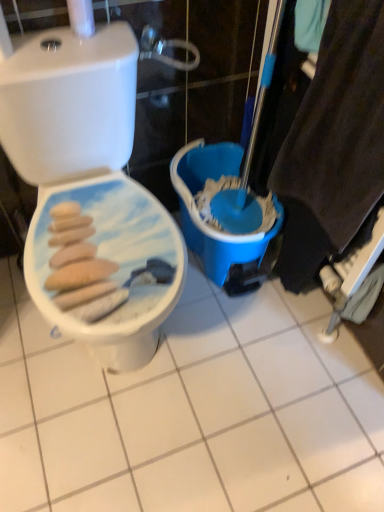
This screenshot has width=384, height=512. What are the coordinates of `free space above white glossy ceramic tile at center (from a real-world perspective)` in the screenshot? It's located at (188, 389).